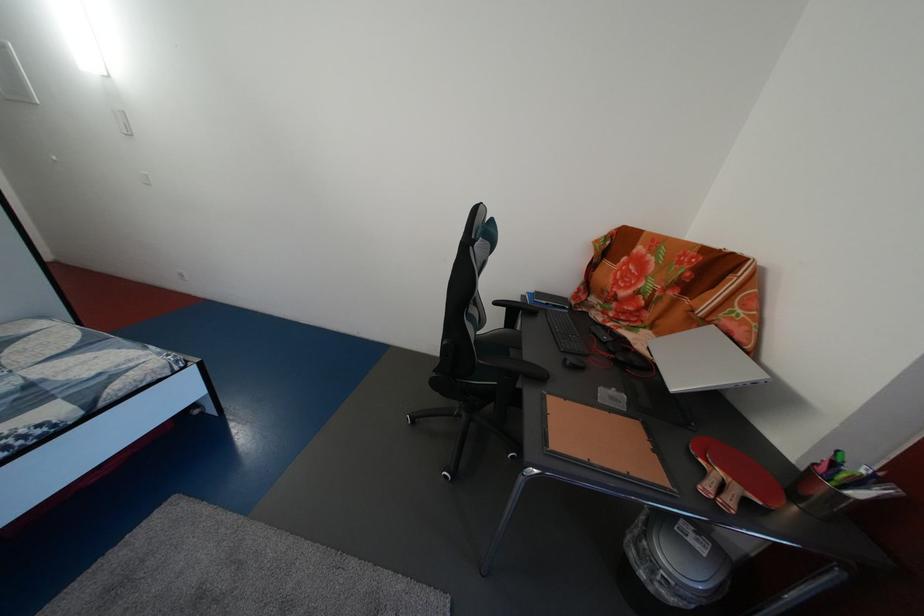
Image resolution: width=924 pixels, height=616 pixels. I want to click on white light switch, so click(123, 122).